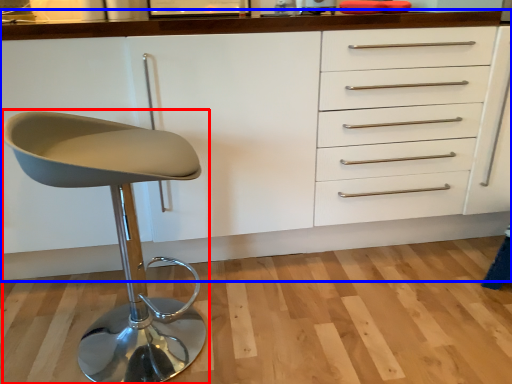
Question: Which point is further to the camera, chair (highlighted by a red box) or cabinetry (highlighted by a blue box)?

Choices:
 (A) chair
 (B) cabinetry

Answer: (B)